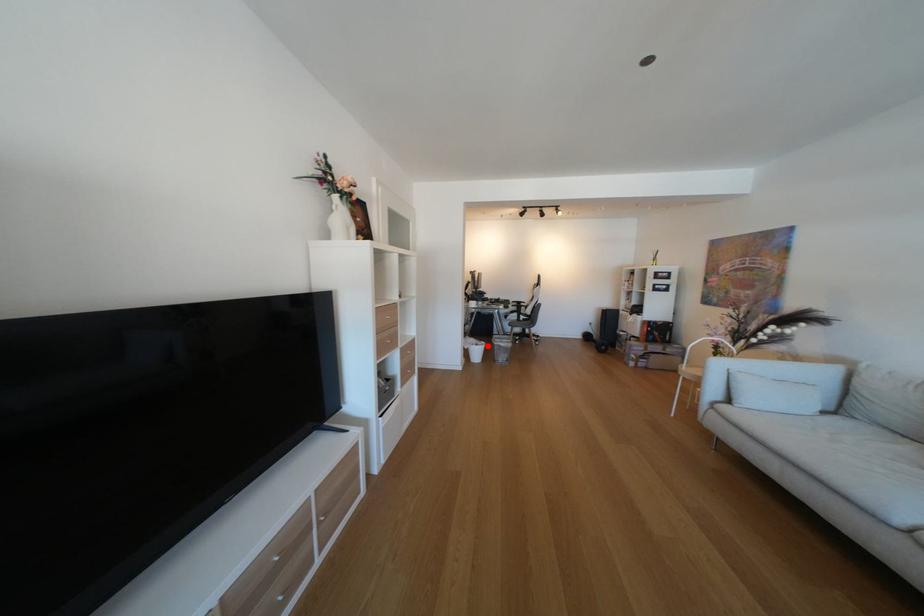
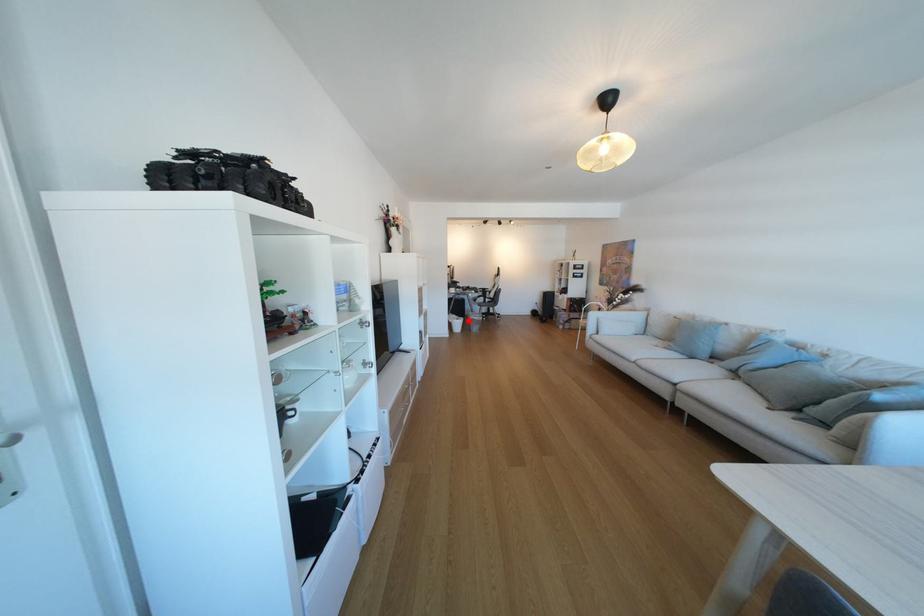
I am providing you with two images of the same scene from different viewpoints. A red point is marked on the first image and another point is marked on the second image. Do the highlighted points in image1 and image2 indicate the same real-world spot?

Yes